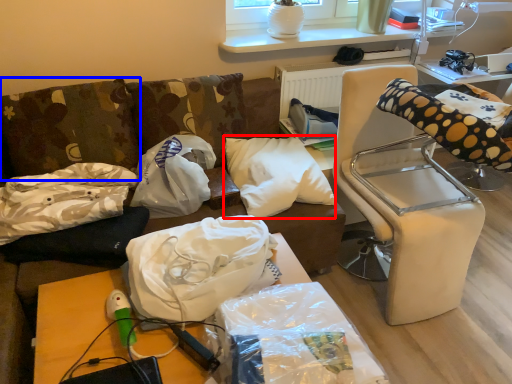
Question: Which of the following is the closest to the observer, pillow (highlighted by a red box) or pillow (highlighted by a blue box)?

Choices:
 (A) pillow
 (B) pillow

Answer: (B)